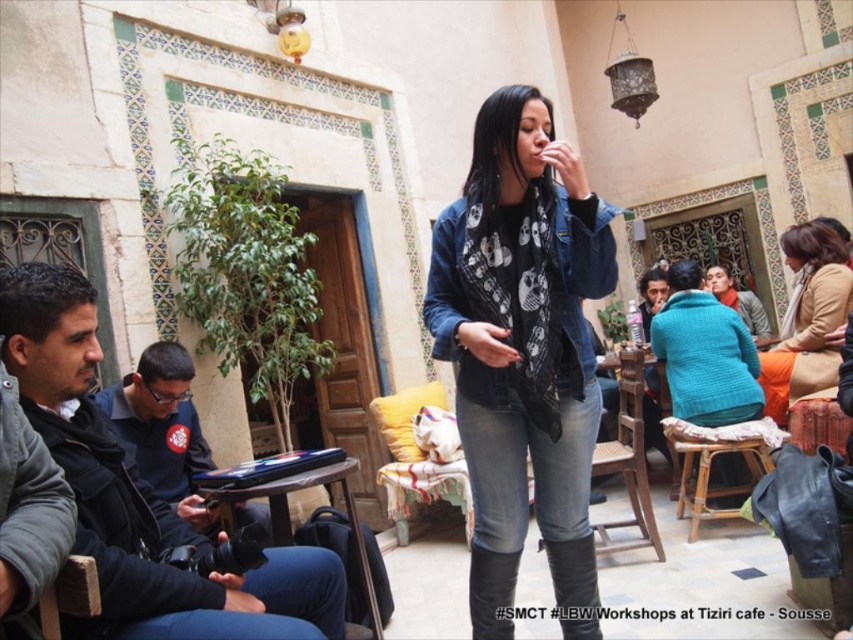
Between point (492, 120) and point (843, 300), which one is positioned behind?

Positioned behind is point (843, 300).

Can you confirm if denim jacket at center is bigger than beige woolen scarf at upper right?

Correct, denim jacket at center is larger in size than beige woolen scarf at upper right.

Is point (505, 442) positioned after point (838, 307)?

No, (505, 442) is in front of (838, 307).

At what (x,y) coordinates should I click in order to perform the action: click on denim jacket at center. Please return your answer as a coordinate pair (x, y). This screenshot has height=640, width=853. Looking at the image, I should click on (523, 352).

Is denim jacket at center smaller than black leather jacket at left?

Yes.

At what (x,y) coordinates should I click in order to perform the action: click on denim jacket at center. Please return your answer as a coordinate pair (x, y). Looking at the image, I should click on (523, 352).

Does jeans at center have a lesser height compared to brown woven stool at lower center?

Yes.

At what (x,y) coordinates should I click in order to perform the action: click on jeans at center. Please return your answer as a coordinate pair (x, y). This screenshot has width=853, height=640. Looking at the image, I should click on (526, 470).